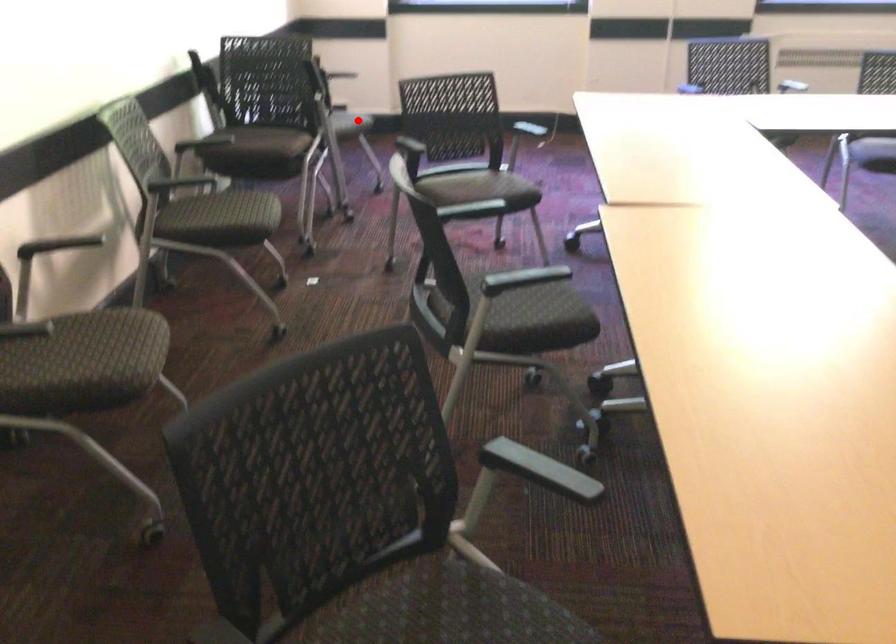
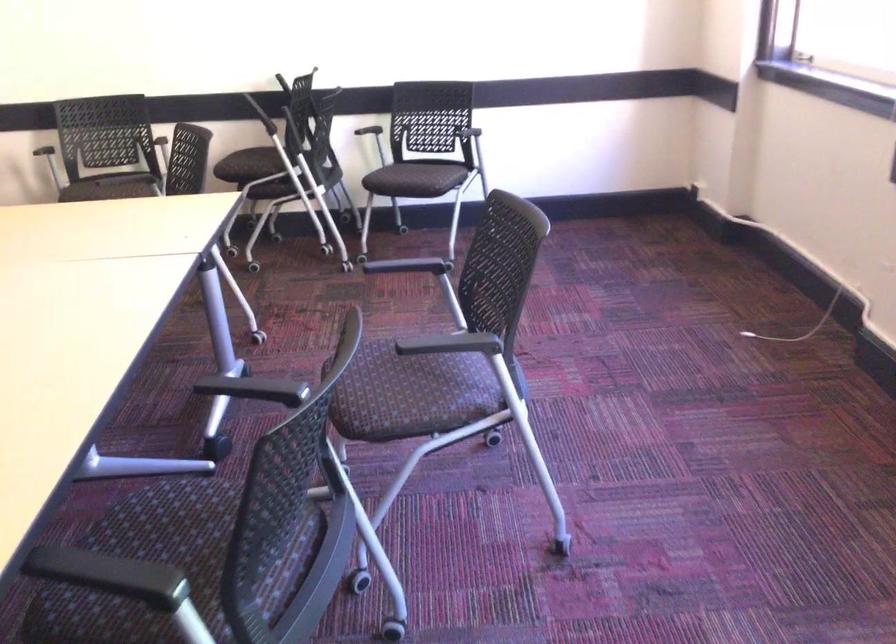
Find the pixel in the second image that matches the highlighted location in the first image.

(415, 178)